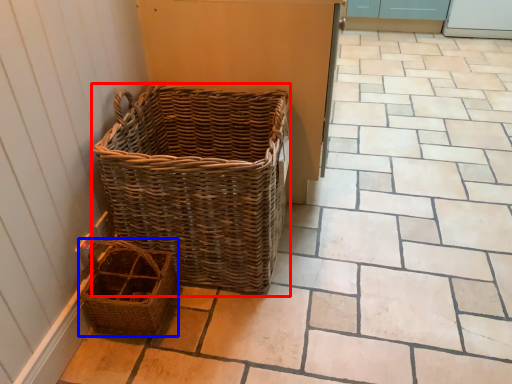
Question: Which of the following is the closest to the observer, picnic basket (highlighted by a red box) or picnic basket (highlighted by a blue box)?

Choices:
 (A) picnic basket
 (B) picnic basket

Answer: (A)